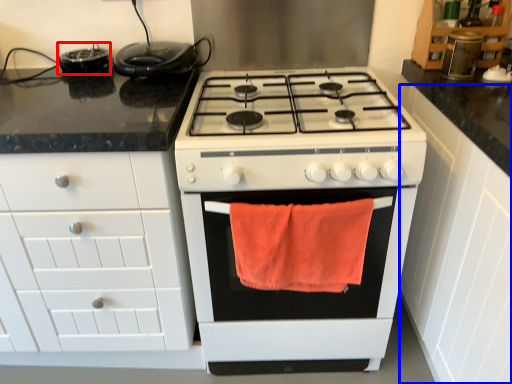
Question: Among these objects, which one is farthest to the camera, appliance (highlighted by a red box) or cabinetry (highlighted by a blue box)?

Choices:
 (A) appliance
 (B) cabinetry

Answer: (A)